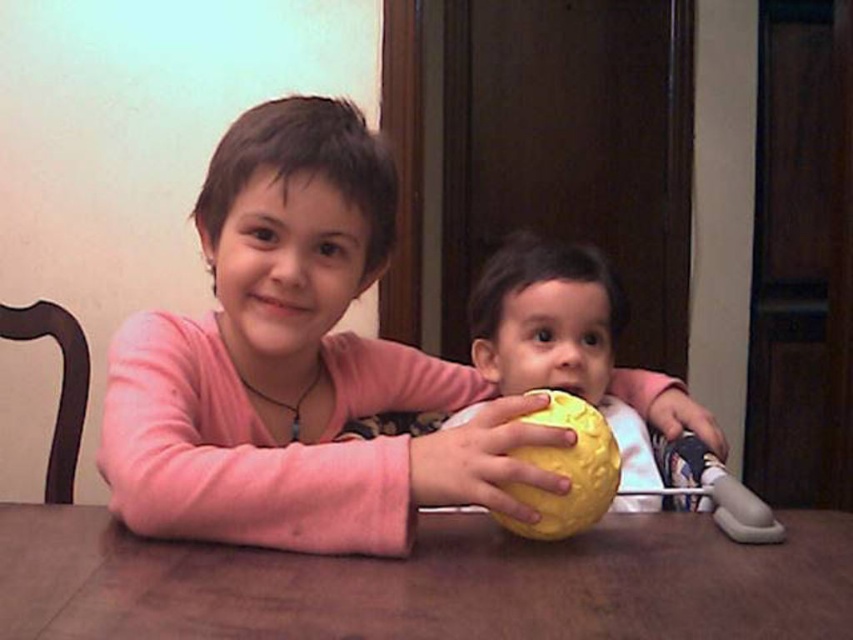
Question: Which of the following is the closest to the observer?

Choices:
 (A) yellow rubber ball at center
 (B) smooth wooden table at center

Answer: (B)

Question: Does matte yellow ball at center appear over yellow rubber ball at center?

Choices:
 (A) yes
 (B) no

Answer: (A)

Question: Which object is positioned farthest from the smooth wooden table at center?

Choices:
 (A) yellow rubber ball at center
 (B) matte yellow ball at center

Answer: (A)

Question: Which object is farther from the camera taking this photo?

Choices:
 (A) smooth wooden table at center
 (B) matte yellow ball at center
 (C) yellow rubber ball at center

Answer: (C)

Question: Is smooth wooden table at center bigger than yellow rubber ball at center?

Choices:
 (A) no
 (B) yes

Answer: (A)

Question: Does matte yellow ball at center appear under smooth wooden table at center?

Choices:
 (A) yes
 (B) no

Answer: (B)